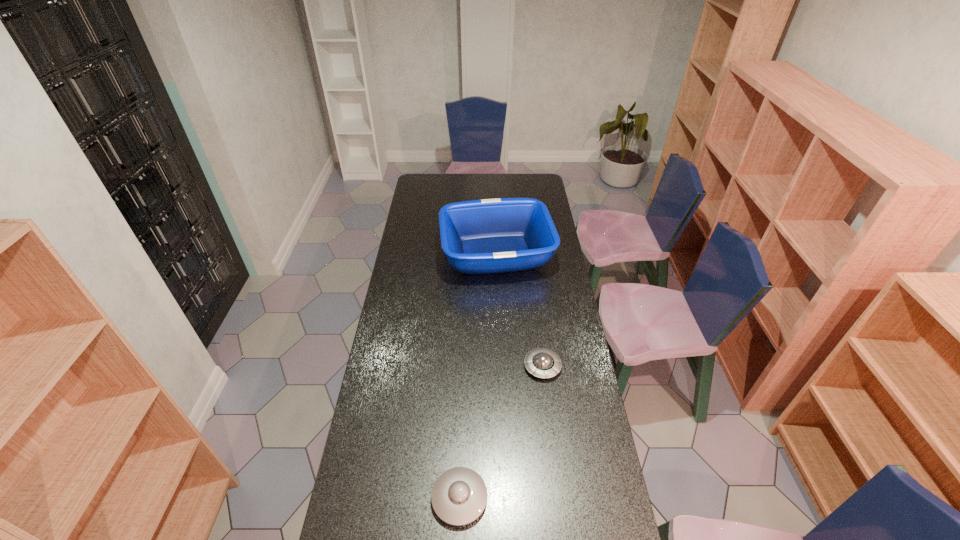
Locate an element on the screen. vacant area that lies between the nearest object and the tallest object is located at coordinates (478, 376).

The width and height of the screenshot is (960, 540). What are the coordinates of `free space between the farther saucer and the nearest object` in the screenshot? It's located at (501, 432).

This screenshot has height=540, width=960. In order to click on free point between the farther saucer and the tray in this screenshot , I will do `click(519, 310)`.

This screenshot has height=540, width=960. What are the coordinates of `the closest object to the farther saucer` in the screenshot? It's located at (459, 496).

Identify which object is the second closest to the farthest object. Please provide its 2D coordinates. Your answer should be formatted as a tuple, i.e. [(x, y)], where the tuple contains the x and y coordinates of a point satisfying the conditions above.

[(459, 496)]

Point out which saucer is positioned as the nearest to the tray. Please provide its 2D coordinates. Your answer should be formatted as a tuple, i.e. [(x, y)], where the tuple contains the x and y coordinates of a point satisfying the conditions above.

[(543, 363)]

Find the location of a particular element. Image resolution: width=960 pixels, height=540 pixels. saucer that stands as the closest to the farthest object is located at coordinates (543, 363).